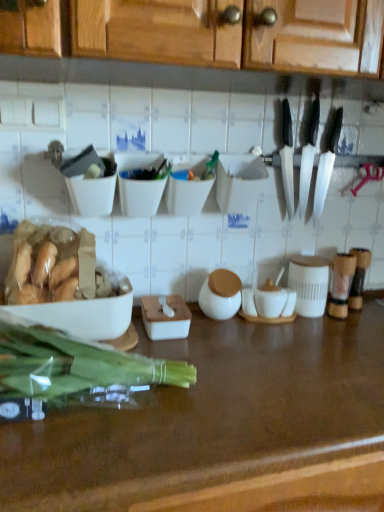
Question: Considering the relative sizes of translucent plastic green vegetables at left and silver metallic knife at upper right, arranged as the first kitchen knife when viewed from the right, in the image provided, is translucent plastic green vegetables at left smaller than silver metallic knife at upper right, arranged as the first kitchen knife when viewed from the right,?

Choices:
 (A) yes
 (B) no

Answer: (B)

Question: Considering the relative positions of translucent plastic green vegetables at left and silver metallic knife at upper right, positioned as the second kitchen knife in left-to-right order, in the image provided, is translucent plastic green vegetables at left to the left of silver metallic knife at upper right, positioned as the second kitchen knife in left-to-right order, from the viewer's perspective?

Choices:
 (A) no
 (B) yes

Answer: (B)

Question: Does translucent plastic green vegetables at left have a lesser width compared to silver metallic knife at upper right, arranged as the first kitchen knife when viewed from the right?

Choices:
 (A) no
 (B) yes

Answer: (A)

Question: Is translucent plastic green vegetables at left outside silver metallic knife at upper right, positioned as the second kitchen knife in left-to-right order?

Choices:
 (A) no
 (B) yes

Answer: (B)

Question: Considering the relative sizes of translucent plastic green vegetables at left and silver metallic knife at upper right, arranged as the first kitchen knife when viewed from the right, in the image provided, is translucent plastic green vegetables at left shorter than silver metallic knife at upper right, arranged as the first kitchen knife when viewed from the right,?

Choices:
 (A) yes
 (B) no

Answer: (A)

Question: From a real-world perspective, does translucent plastic green vegetables at left stand above silver metallic knife at upper right, positioned as the second kitchen knife in left-to-right order?

Choices:
 (A) no
 (B) yes

Answer: (A)

Question: From the image's perspective, does silver metallic knife at upper right, arranged as the first kitchen knife when viewed from the right, appear higher than white plastic container at center, acting as the third bowl starting from the left?

Choices:
 (A) no
 (B) yes

Answer: (B)

Question: Is silver metallic knife at upper right, positioned as the second kitchen knife in left-to-right order, positioned with its back to white plastic container at center, the 1th bowl from the right?

Choices:
 (A) yes
 (B) no

Answer: (B)

Question: Does silver metallic knife at upper right, positioned as the second kitchen knife in left-to-right order, have a larger size compared to white plastic container at center, the 1th bowl from the right?

Choices:
 (A) yes
 (B) no

Answer: (A)

Question: Does silver metallic knife at upper right, positioned as the second kitchen knife in left-to-right order, have a smaller size compared to white plastic container at center, acting as the third bowl starting from the left?

Choices:
 (A) no
 (B) yes

Answer: (A)

Question: Is silver metallic knife at upper right, positioned as the second kitchen knife in left-to-right order, closer to camera compared to white plastic container at center, acting as the third bowl starting from the left?

Choices:
 (A) no
 (B) yes

Answer: (A)

Question: From a real-world perspective, is silver metallic knife at upper right, arranged as the first kitchen knife when viewed from the right, located higher than white plastic container at center, acting as the third bowl starting from the left?

Choices:
 (A) no
 (B) yes

Answer: (B)

Question: From the image's perspective, is white matte bowl at upper left, the 1th bowl viewed from the left, below silver metallic knife at upper right, positioned as the second kitchen knife in left-to-right order?

Choices:
 (A) yes
 (B) no

Answer: (A)